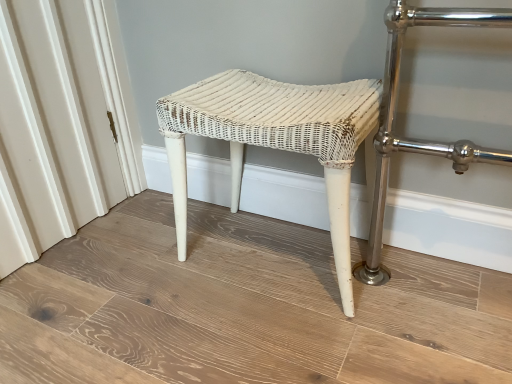
This screenshot has width=512, height=384. I want to click on vacant space to the right of white wicker stool at center, so click(426, 287).